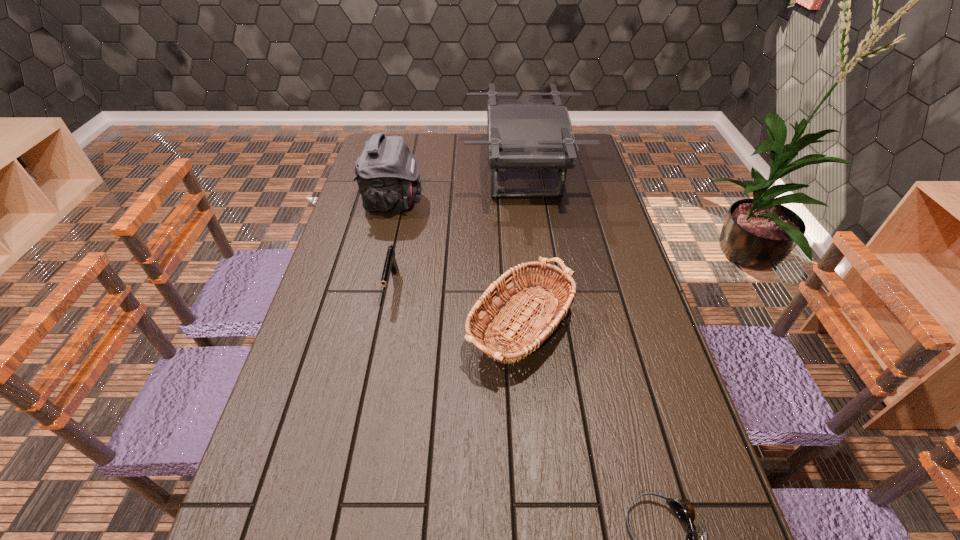
At what (x,y) coordinates should I click in order to perform the action: click on object that is at the far edge. Please return your answer as a coordinate pair (x, y). Looking at the image, I should click on (522, 133).

In order to click on object present at the left edge in this screenshot , I will do `click(387, 173)`.

Identify the location of drone present at the right edge. (522, 133).

Locate an element on the screen. Image resolution: width=960 pixels, height=540 pixels. basket present at the right edge is located at coordinates (555, 293).

Image resolution: width=960 pixels, height=540 pixels. In order to click on object positioned at the far right corner in this screenshot , I will do point(522,133).

Where is `vacant space at the far edge of the desktop`? The width and height of the screenshot is (960, 540). vacant space at the far edge of the desktop is located at coordinates (420, 138).

Where is `blank space at the left edge of the desktop`? blank space at the left edge of the desktop is located at coordinates (359, 250).

At what (x,y) coordinates should I click in order to perform the action: click on vacant space at the right edge of the desktop. Please return your answer as a coordinate pair (x, y). Looking at the image, I should click on click(588, 236).

This screenshot has width=960, height=540. Identify the location of free space between the pistol and the shoulder bag. (393, 244).

You are a GUI agent. You are given a task and a screenshot of the screen. Output one action in this format:
    pyautogui.click(x=<x>, y=<y>)
    Task: Click on the free space between the pistol and the shoulder bag
    Image resolution: width=960 pixels, height=540 pixels.
    Given the screenshot: What is the action you would take?
    pyautogui.click(x=393, y=244)